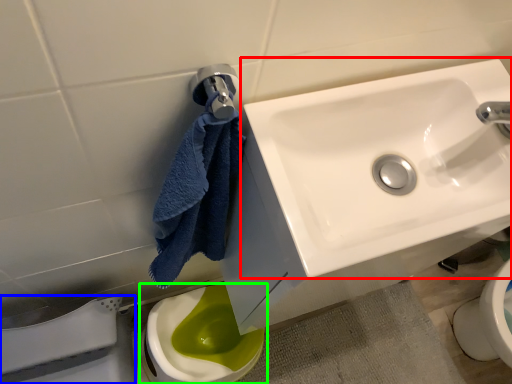
Question: Considering the real-world distances, which object is closest to sink (highlighted by a red box)? porcelain (highlighted by a blue box) or toilet (highlighted by a green box).

Choices:
 (A) porcelain
 (B) toilet

Answer: (A)